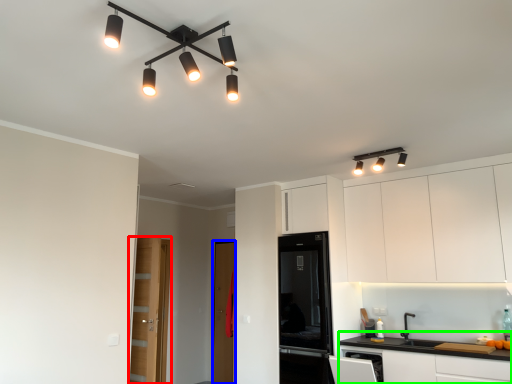
Question: Considering the real-world distances, which object is farthest from door (highlighted by a red box)? glass door (highlighted by a blue box) or cabinetry (highlighted by a green box)?

Choices:
 (A) glass door
 (B) cabinetry

Answer: (B)